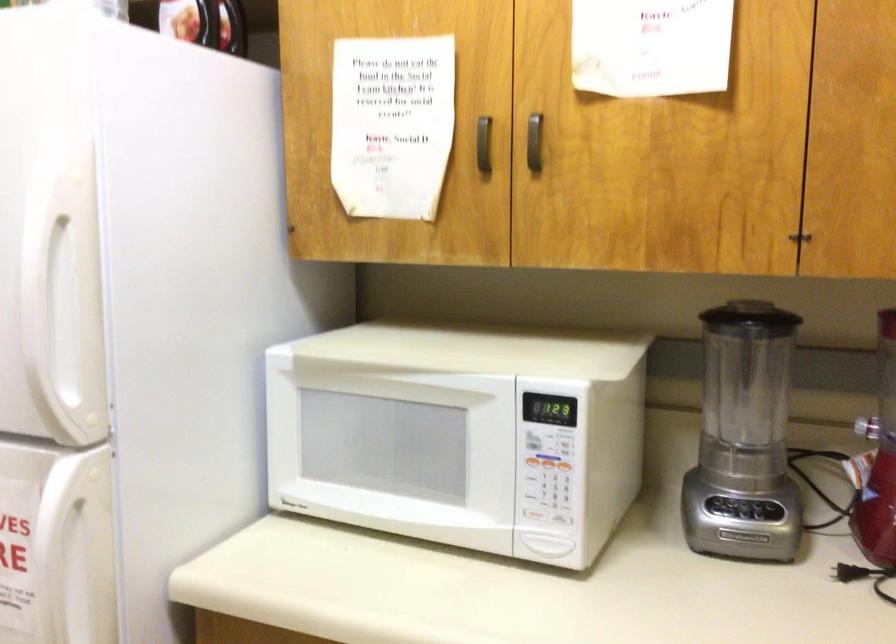
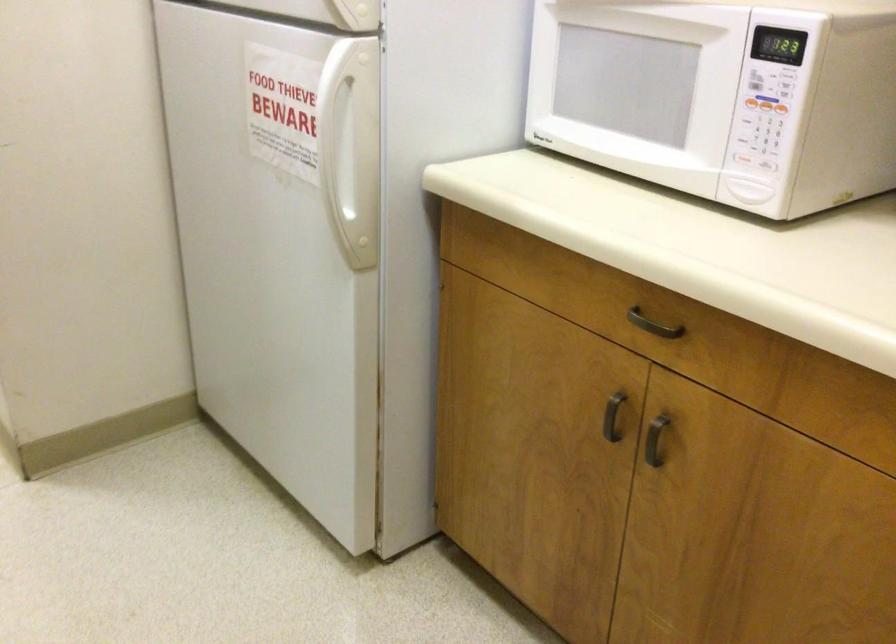
Find the pixel in the second image that matches point (538, 466) in the first image.

(752, 102)